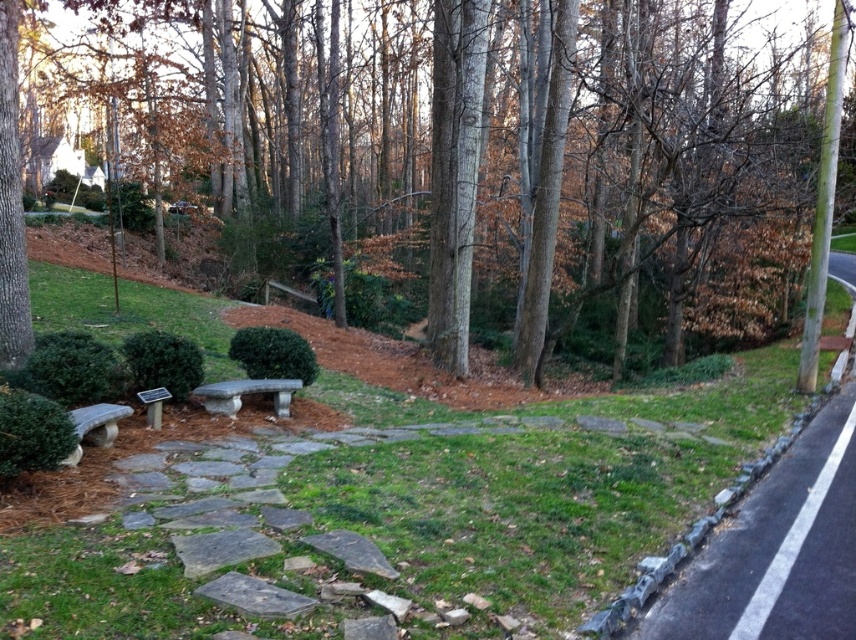
Question: Estimate the real-world distances between objects in this image. Which object is farther from the brown smooth tree at center?

Choices:
 (A) gray stone bench at center
 (B) gray stone bench at lower left
 (C) gray concrete path at lower right
 (D) green grass at center

Answer: (C)

Question: Which of the following is the closest to the observer?

Choices:
 (A) gray stone bench at lower left
 (B) green grass at center

Answer: (B)

Question: Does green grass at center have a larger size compared to gray stone bench at lower left?

Choices:
 (A) no
 (B) yes

Answer: (B)

Question: Does gray stone bench at center come in front of gray stone bench at lower left?

Choices:
 (A) yes
 (B) no

Answer: (B)

Question: Does gray concrete path at lower right appear on the right side of gray stone bench at lower left?

Choices:
 (A) yes
 (B) no

Answer: (A)

Question: Which point appears farthest from the camera in this image?

Choices:
 (A) (293, 380)
 (B) (789, 464)
 (C) (788, 257)
 (D) (114, 426)

Answer: (C)